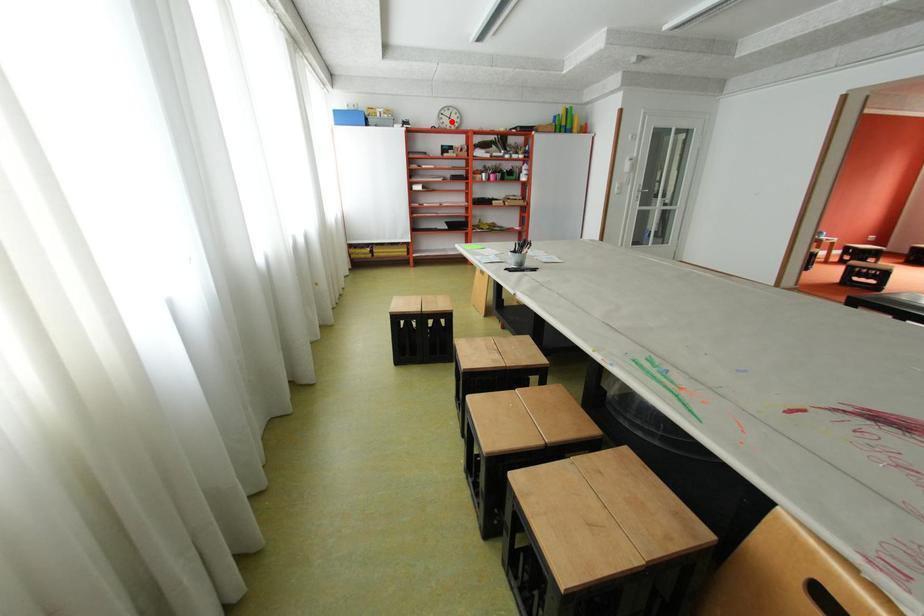
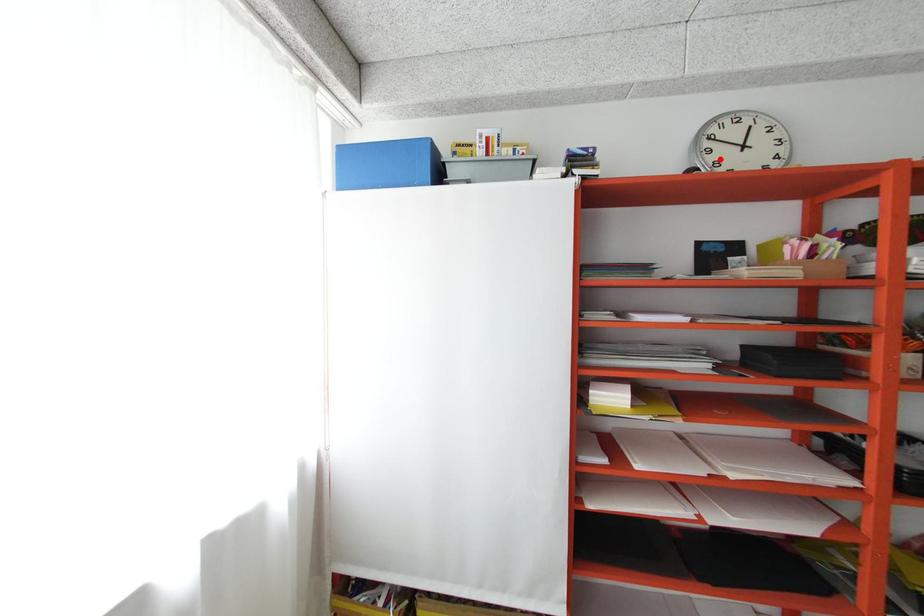
I am providing you with two images of the same scene from different viewpoints. A red point is marked on the first image and another point is marked on the second image. Is the marked point in image1 the same physical position as the marked point in image2?

Yes